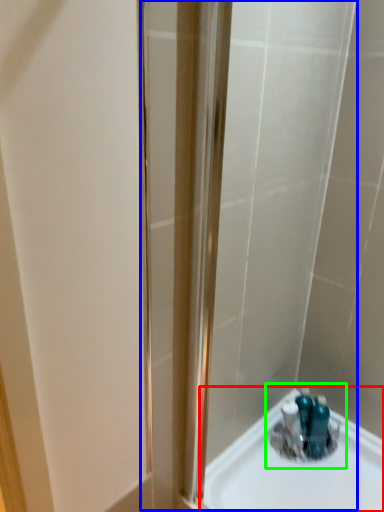
Question: Which is farther away from sink (highlighted by a red box)? shower door (highlighted by a blue box) or sink (highlighted by a green box)?

Choices:
 (A) shower door
 (B) sink

Answer: (A)